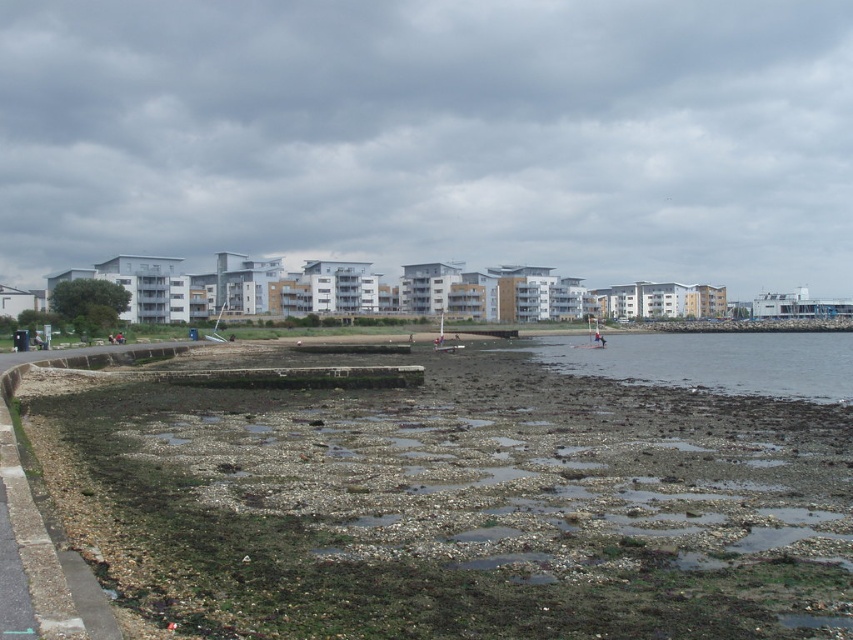
Is rough stone beach at center wider than brown rocky water at lower center?

Incorrect, rough stone beach at center's width does not surpass brown rocky water at lower center's.

Can you confirm if rough stone beach at center is taller than brown rocky water at lower center?

Yes, rough stone beach at center is taller than brown rocky water at lower center.

Locate an element on the screen. rough stone beach at center is located at coordinates (459, 506).